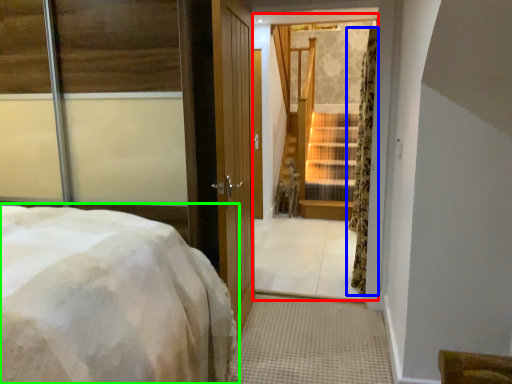
Question: Which object is the closest to the window (highlighted by a red box)? Choose among these: curtain (highlighted by a blue box) or bed (highlighted by a green box).

Choices:
 (A) curtain
 (B) bed

Answer: (A)